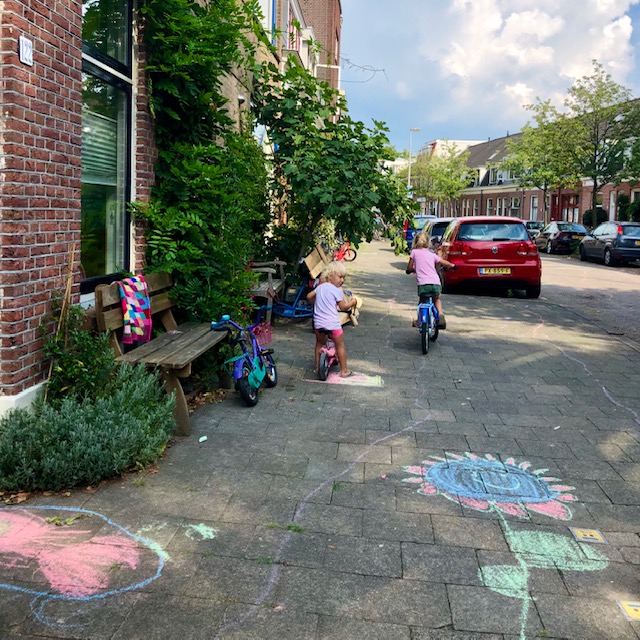
At what (x,y) coordinates should I click in order to perform the action: click on blanket. Please return your answer as a coordinate pair (x, y). Looking at the image, I should click on (137, 316).